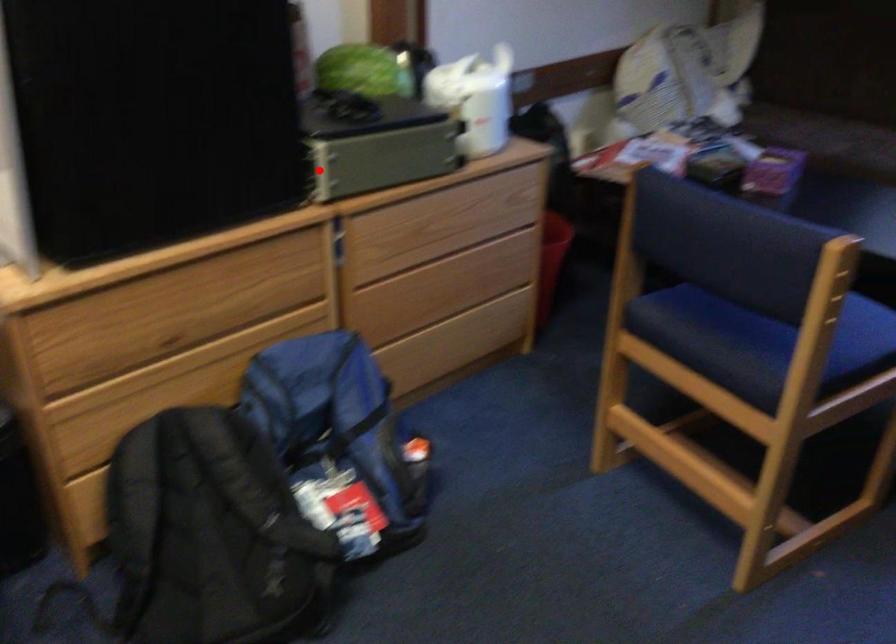
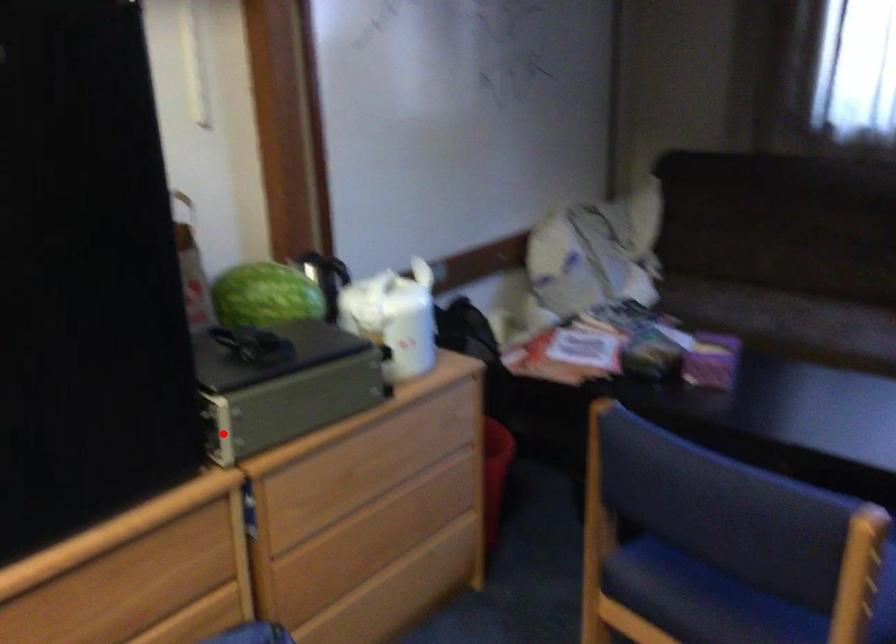
I am providing you with two images of the same scene from different viewpoints. A red point is marked on the first image and another point is marked on the second image. Is the red point in image1 aligned with the point shown in image2?

Yes